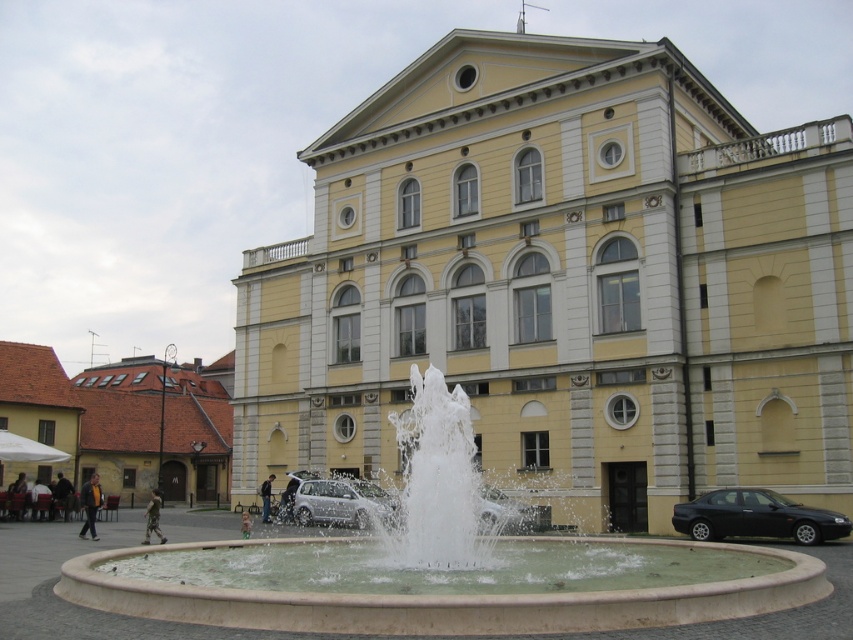
Question: Does silver metallic car at center appear on the left side of yellow fabric jacket at lower left?

Choices:
 (A) no
 (B) yes

Answer: (A)

Question: Is silver metallic car at center above dark brown leather jacket at lower left?

Choices:
 (A) yes
 (B) no

Answer: (A)

Question: Which object is positioned closest to the silver metallic car at center?

Choices:
 (A) camouflage fabric jacket at lower left
 (B) camouflage fabric person at center
 (C) yellow fabric jacket at lower left
 (D) silver metallic hatchback at center

Answer: (D)

Question: Is black metallic sedan at lower right further to camera compared to dark blue jeans at lower center?

Choices:
 (A) yes
 (B) no

Answer: (B)

Question: Which is nearer to the dark blue jeans at lower center?

Choices:
 (A) camouflage fabric jacket at lower left
 (B) dark brown leather jacket at lower left
 (C) white stone fountain at center

Answer: (B)

Question: Estimate the real-world distances between objects in this image. Which object is closer to the dark brown leather jacket at lower left?

Choices:
 (A) black metallic sedan at lower right
 (B) silver metallic car at center
 (C) silver metallic hatchback at center
 (D) yellow fabric jacket at lower left

Answer: (D)